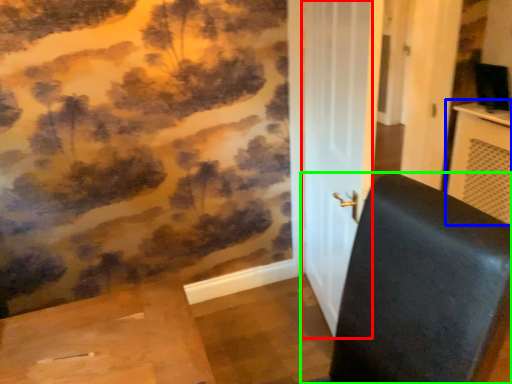
Question: Based on their relative distances, which object is nearer to screen door (highlighted by a red box)? Choose from table (highlighted by a blue box) and furniture (highlighted by a green box).

Choices:
 (A) table
 (B) furniture

Answer: (B)